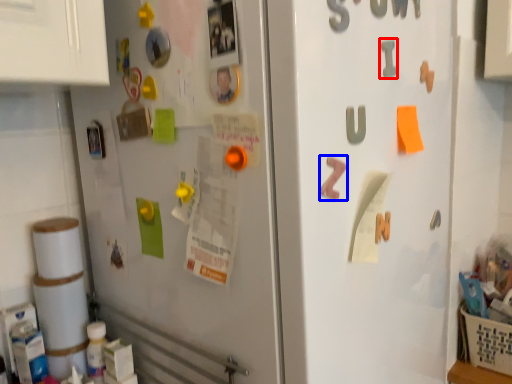
Question: Among these objects, which one is nearest to the camera, alphabet (highlighted by a red box) or alphabet (highlighted by a blue box)?

Choices:
 (A) alphabet
 (B) alphabet

Answer: (B)